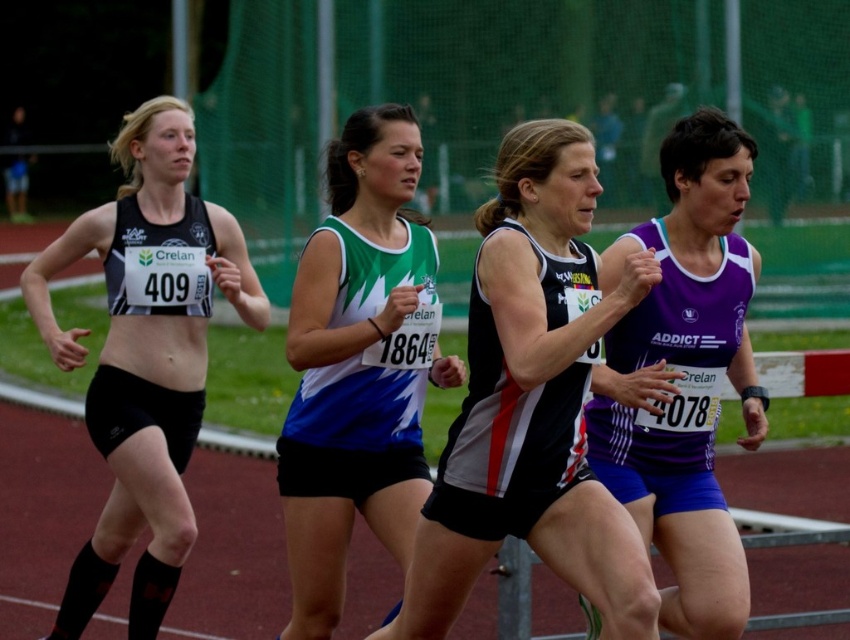
Question: Among these objects, which one is nearest to the camera?

Choices:
 (A) matte black tank top at left
 (B) purple synthetic running top at center
 (C) black and white athletic top at center

Answer: (C)

Question: Is black and white athletic top at center positioned behind green and white jersey at center?

Choices:
 (A) yes
 (B) no

Answer: (B)

Question: Is black and white athletic top at center to the left of purple synthetic running top at center from the viewer's perspective?

Choices:
 (A) yes
 (B) no

Answer: (A)

Question: Which is farther from the matte black tank top at left?

Choices:
 (A) black and white athletic top at center
 (B) green and white jersey at center

Answer: (A)

Question: Observing the image, what is the correct spatial positioning of matte black tank top at left in reference to green and white jersey at center?

Choices:
 (A) left
 (B) right

Answer: (A)

Question: Which of the following is the closest to the observer?

Choices:
 (A) green and white jersey at center
 (B) black and white athletic top at center

Answer: (B)